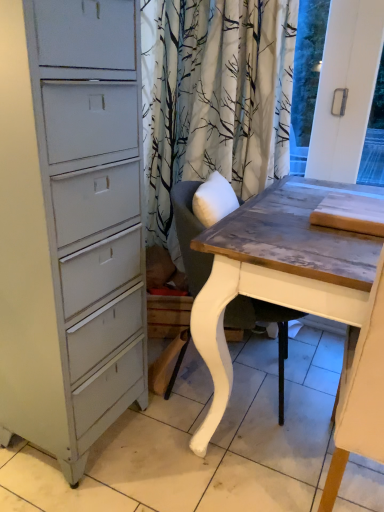
What is the approximate height of wooden table at right?

38.25 inches.

Describe the element at coordinates (268, 271) in the screenshot. I see `wooden table at right` at that location.

Where is `wooden table at right`? Image resolution: width=384 pixels, height=512 pixels. wooden table at right is located at coordinates (268, 271).

What do you see at coordinates (190, 234) in the screenshot? I see `white painted wood chair at center` at bounding box center [190, 234].

Where is `white painted wood chair at center`? white painted wood chair at center is located at coordinates (190, 234).

Measure the distance between white painted wood chair at center and camera.

white painted wood chair at center is 1.19 meters away from camera.

The image size is (384, 512). In order to click on wooden table at right in this screenshot , I will do `click(268, 271)`.

Can you confirm if wooden table at right is positioned to the left of white painted wood chair at center?

Incorrect, wooden table at right is not on the left side of white painted wood chair at center.

Between wooden table at right and white painted wood chair at center, which one is positioned behind?

white painted wood chair at center.

Is point (267, 267) positioned before point (233, 305)?

Yes, it is in front of point (233, 305).

From the image's perspective, relative to white painted wood chair at center, is wooden table at right above or below?

From the image's perspective, wooden table at right appears below white painted wood chair at center.

From a real-world perspective, between wooden table at right and white painted wood chair at center, who is vertically lower?

white painted wood chair at center.

Considering the relative sizes of wooden table at right and white painted wood chair at center in the image provided, is wooden table at right wider than white painted wood chair at center?

Indeed, wooden table at right has a greater width compared to white painted wood chair at center.

Which of these two, wooden table at right or white painted wood chair at center, stands shorter?

white painted wood chair at center is shorter.

Based on their sizes in the image, would you say wooden table at right is bigger or smaller than white painted wood chair at center?

Clearly, wooden table at right is smaller in size than white painted wood chair at center.

Is wooden table at right inside the boundaries of white painted wood chair at center, or outside?

wooden table at right exists outside the volume of white painted wood chair at center.

Is wooden table at right touching white painted wood chair at center?

No.

Is wooden table at right aimed at white painted wood chair at center?

No, wooden table at right is not facing towards white painted wood chair at center.

The image size is (384, 512). I want to click on table above the white painted wood chair at center (from a real-world perspective), so click(x=268, y=271).

Considering the positions of objects white painted wood chair at center and wooden table at right in the image provided, who is more to the left, white painted wood chair at center or wooden table at right?

From the viewer's perspective, white painted wood chair at center appears more on the left side.

Relative to wooden table at right, is white painted wood chair at center in front or behind?

In the image, white painted wood chair at center appears behind wooden table at right.

Between point (195, 218) and point (207, 329), which one is positioned behind?

Point (195, 218)

From the image's perspective, between white painted wood chair at center and wooden table at right, who is located below?

wooden table at right.

From a real-world perspective, is white painted wood chair at center under wooden table at right?

Indeed, from a real-world perspective, white painted wood chair at center is positioned beneath wooden table at right.

Looking at this image, does white painted wood chair at center have a greater width compared to wooden table at right?

No.

Between white painted wood chair at center and wooden table at right, which one has more height?

wooden table at right.

Considering the relative sizes of white painted wood chair at center and wooden table at right in the image provided, is white painted wood chair at center bigger than wooden table at right?

Indeed, white painted wood chair at center has a larger size compared to wooden table at right.

Is wooden table at right a part of white painted wood chair at center?

Definitely not — wooden table at right is not inside white painted wood chair at center.

Is there a large distance between white painted wood chair at center and wooden table at right?

No, white painted wood chair at center is in close proximity to wooden table at right.

Is white painted wood chair at center facing towards wooden table at right?

Yes, white painted wood chair at center is turned towards wooden table at right.

In the image, there is a wooden table at right. Where is `chair above it (from the image's perspective)`? Image resolution: width=384 pixels, height=512 pixels. chair above it (from the image's perspective) is located at coordinates (190, 234).

I want to click on table on the right of white painted wood chair at center, so click(268, 271).

I want to click on table that appears below the white painted wood chair at center (from the image's perspective), so click(268, 271).